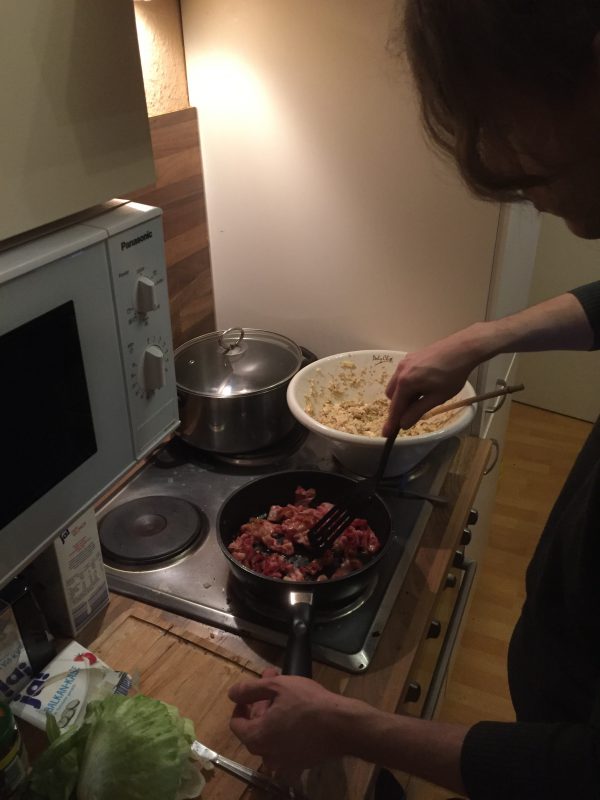
This screenshot has height=800, width=600. Identify the location of white hand on handle of pan. (296, 674).